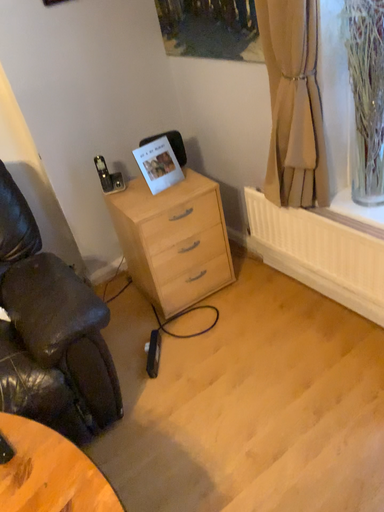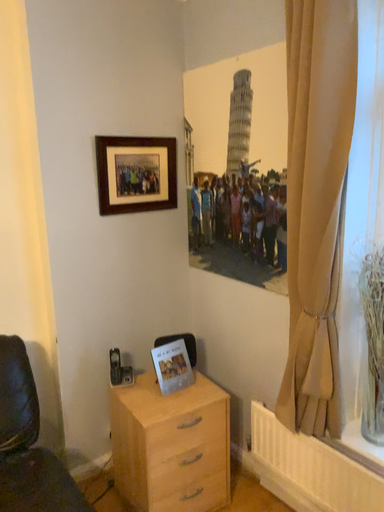
Question: How did the camera likely rotate when shooting the video?

Choices:
 (A) rotated right
 (B) rotated left

Answer: (A)